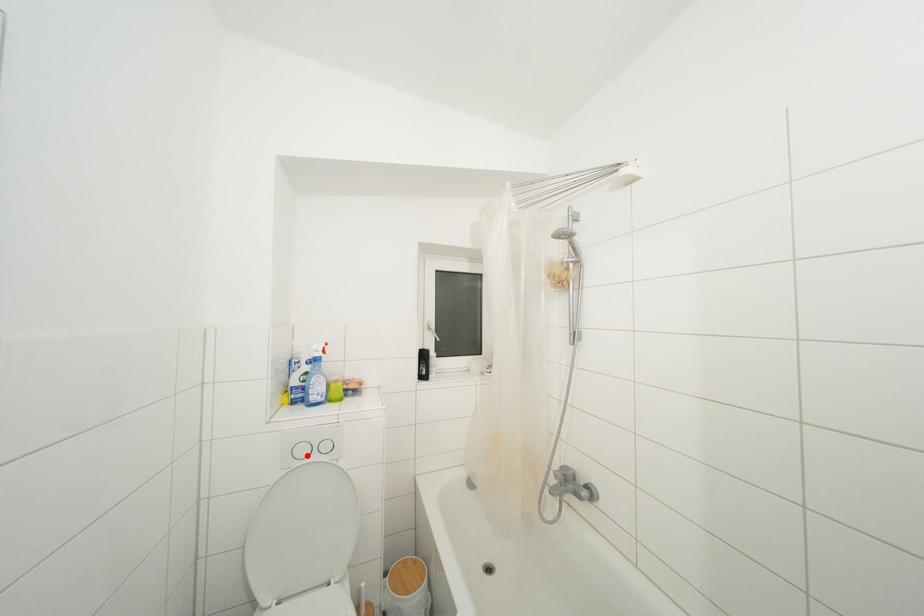
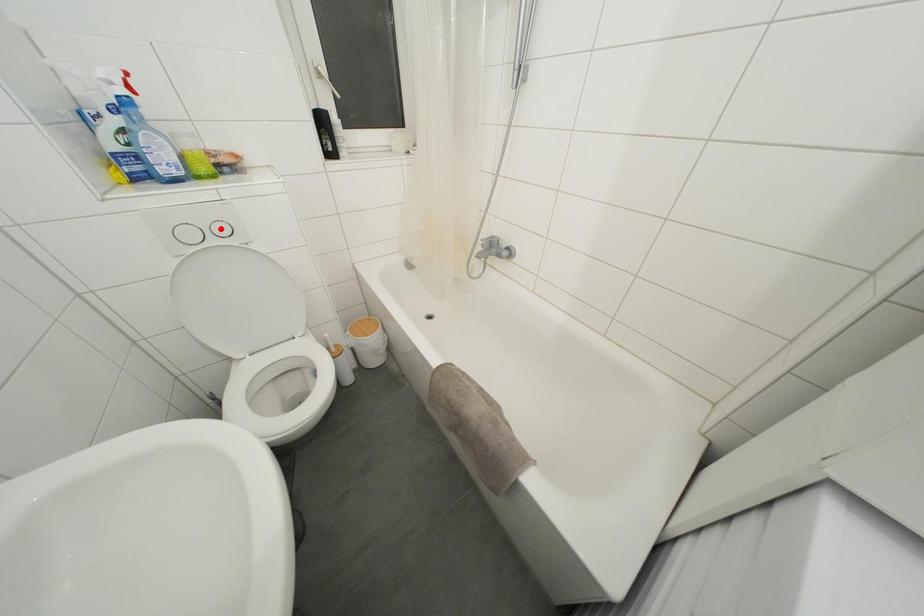
I am providing you with two images of the same scene from different viewpoints. A red point is marked on the first image and another point is marked on the second image. Is the red point in image1 aligned with the point shown in image2?

No